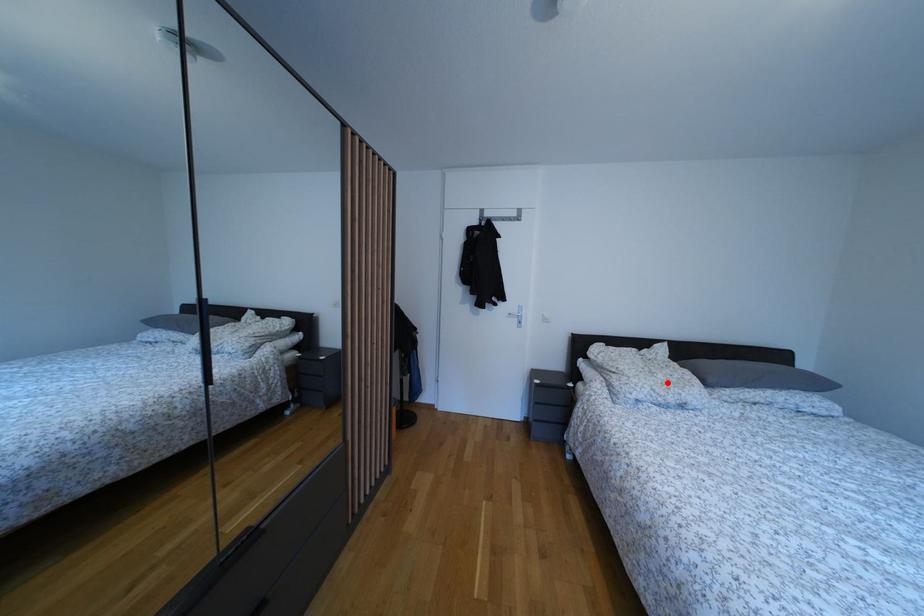
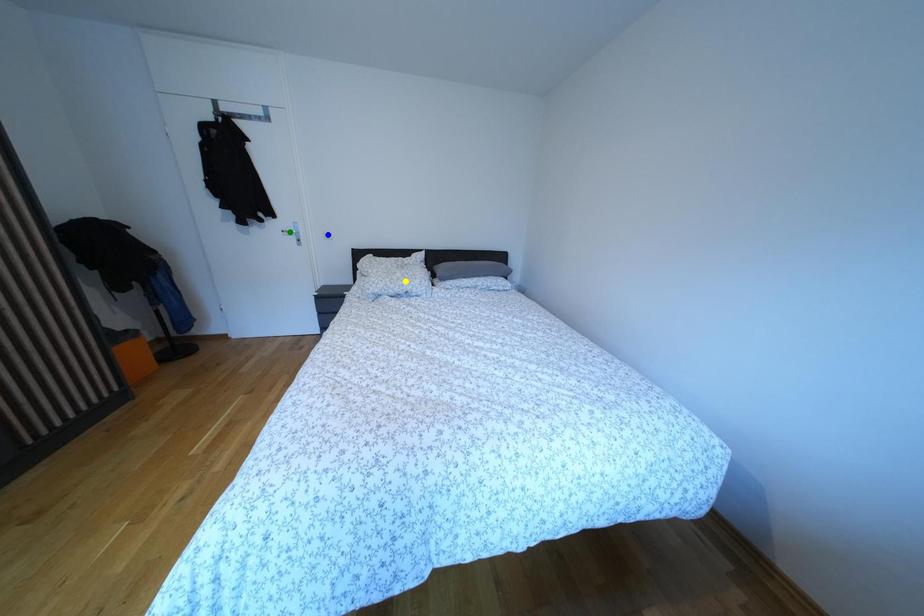
Question: I am providing you with two images of the same scene from different viewpoints. A red point is marked on the first image. You are given multiple points on the second image. Which mark in image 2 goes with the point in image 1?

Choices:
 (A) blue point
 (B) yellow point
 (C) green point

Answer: (B)